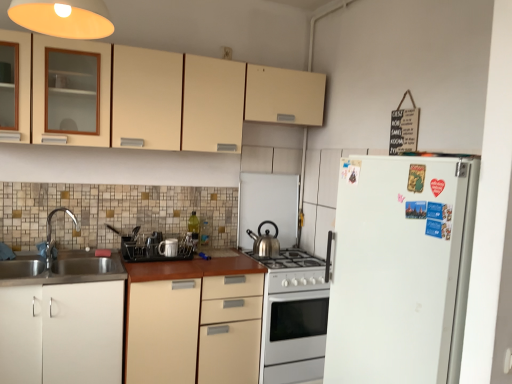
Locate an element on the screen. vacant area in front of white ceramic mug at center, the third appliance positioned from the left is located at coordinates (162, 264).